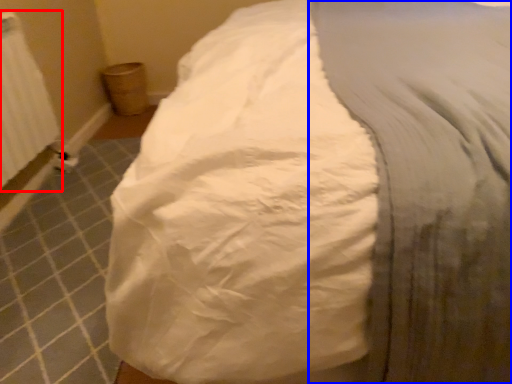
Question: Among these objects, which one is farthest to the camera, radiator (highlighted by a red box) or sheet (highlighted by a blue box)?

Choices:
 (A) radiator
 (B) sheet

Answer: (A)